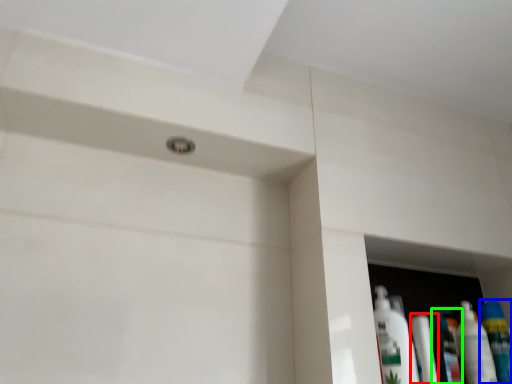
Question: Estimate the real-world distances between objects in this image. Which object is closer to toiletry (highlighted by a red box), mouthwash (highlighted by a blue box) or mouthwash (highlighted by a green box)?

Choices:
 (A) mouthwash
 (B) mouthwash

Answer: (B)